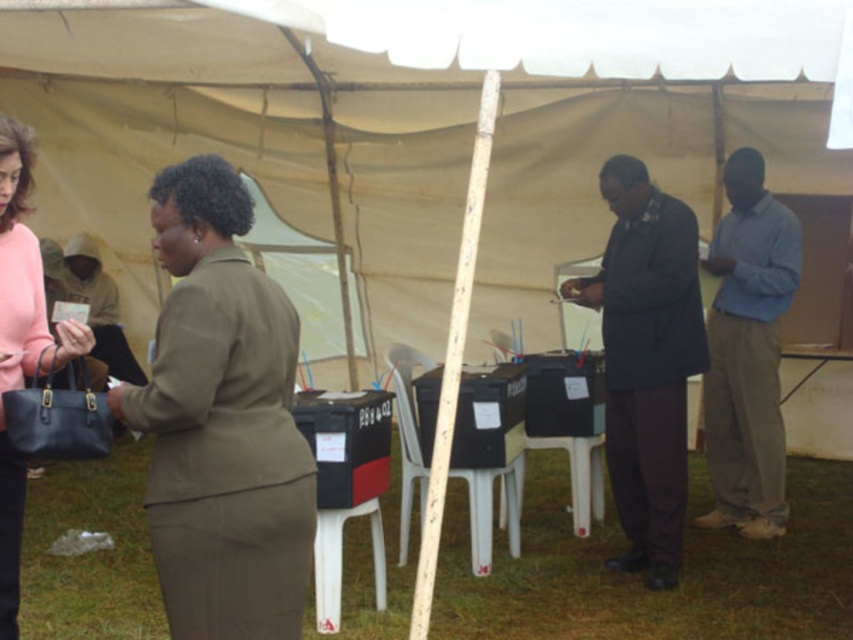
How far apart are dark brown suit at center and blue cotton shirt at right?

A distance of 34.48 inches exists between dark brown suit at center and blue cotton shirt at right.

Is dark brown suit at center shorter than blue cotton shirt at right?

Correct, dark brown suit at center is not as tall as blue cotton shirt at right.

The image size is (853, 640). What do you see at coordinates (646, 360) in the screenshot?
I see `dark brown suit at center` at bounding box center [646, 360].

In order to click on dark brown suit at center in this screenshot , I will do `click(646, 360)`.

Between matte khaki suit at center and blue cotton shirt at right, which one is positioned higher?

blue cotton shirt at right

Is matte khaki suit at center smaller than blue cotton shirt at right?

Yes.

Find the location of a particular element. The height and width of the screenshot is (640, 853). matte khaki suit at center is located at coordinates (221, 420).

Where is `matte khaki suit at center`? This screenshot has height=640, width=853. matte khaki suit at center is located at coordinates (221, 420).

Who is higher up, matte khaki suit at center or dark brown suit at center?

dark brown suit at center is higher up.

Consider the image. Which is more to the left, matte khaki suit at center or dark brown suit at center?

Positioned to the left is matte khaki suit at center.

Between point (198, 548) and point (662, 348), which one is positioned in front?

Point (198, 548)

Identify the location of matte khaki suit at center. The width and height of the screenshot is (853, 640). (221, 420).